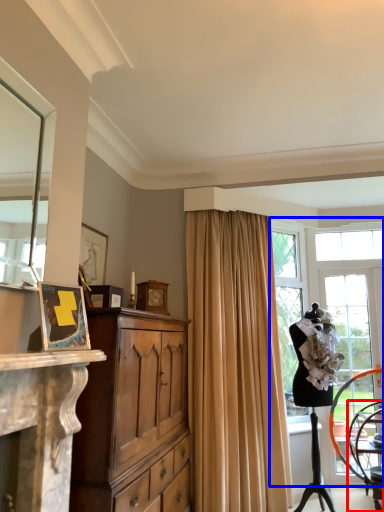
Question: Which object appears closest to the camera in this image, chair (highlighted by a red box) or window (highlighted by a blue box)?

Choices:
 (A) chair
 (B) window

Answer: (B)